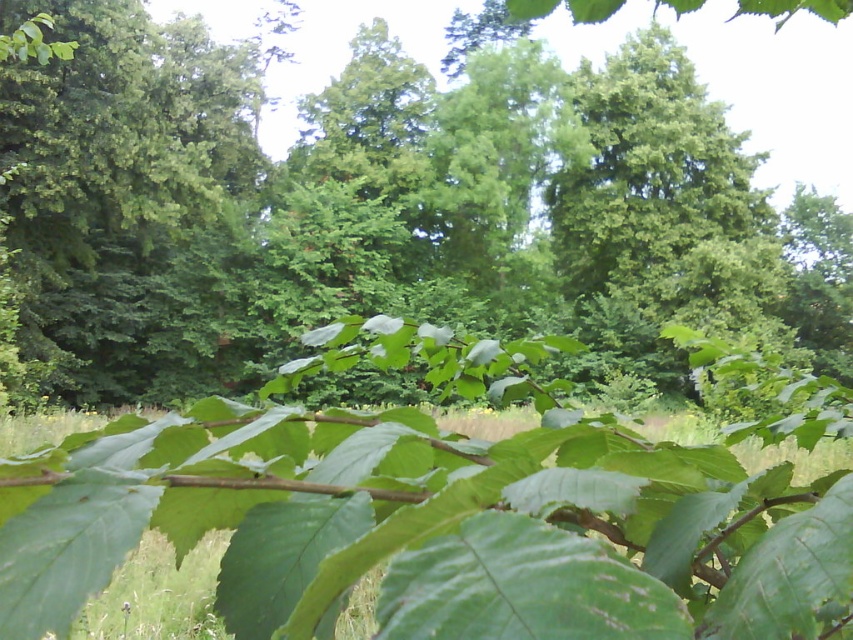
You are standing in the forest and want to place a small wooden bench between the green leafy tree at upper center and the green leafy grass at lower center. Based on their positions, where should you place the bench so it is between both objects?

The green leafy tree at upper center is located above the green leafy grass at lower center, so you should place the bench in the middle area between them to ensure it is between both objects.

You are a hiker who wants to place a small rock between the green leafy branch at center and the green leafy grass at lower center. Based on their positions, which object should you place the rock closer to?

The green leafy grass at lower center is on the right side of the green leafy branch at center, so you should place the rock closer to the green leafy grass at lower center to be between them.